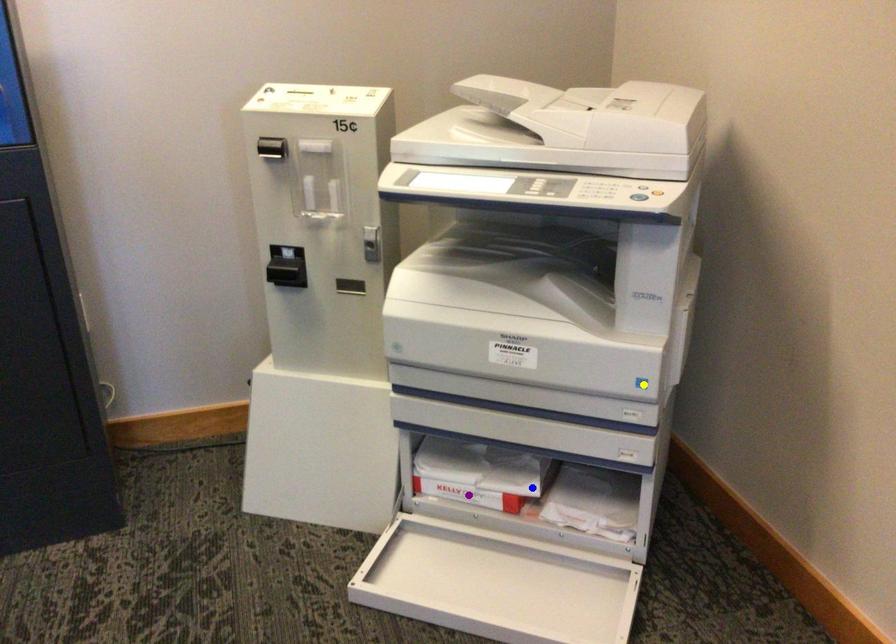
Order these from nearest to farthest:
blue point | purple point | yellow point

yellow point → purple point → blue point